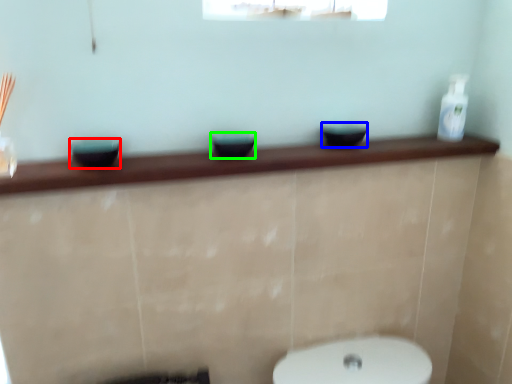
Question: Considering the real-world distances, which object is farthest from basin (highlighted by a red box)? basin (highlighted by a blue box) or basin (highlighted by a green box)?

Choices:
 (A) basin
 (B) basin

Answer: (A)